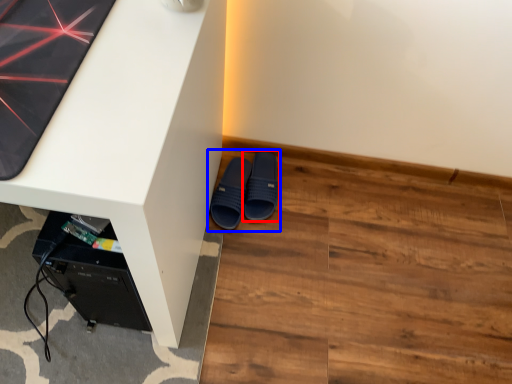
Question: Which point is closer to the camera, footwear (highlighted by a red box) or footwear (highlighted by a blue box)?

Choices:
 (A) footwear
 (B) footwear

Answer: (B)